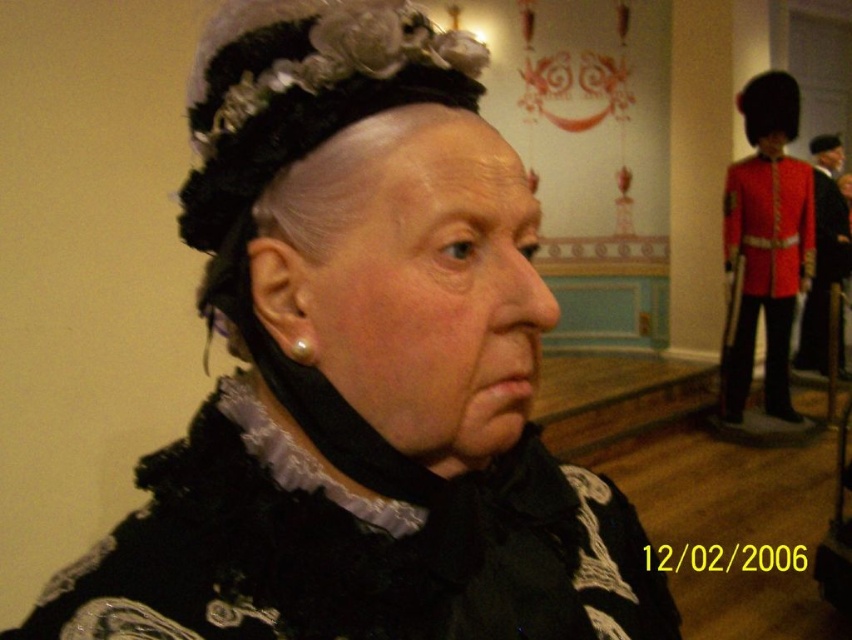
Is black velvet dress at center smaller than red velvet jacket at right?

Indeed, black velvet dress at center has a smaller size compared to red velvet jacket at right.

In the scene shown: Is black velvet dress at center thinner than red velvet jacket at right?

Yes, black velvet dress at center is thinner than red velvet jacket at right.

You are a GUI agent. You are given a task and a screenshot of the screen. Output one action in this format:
    pyautogui.click(x=<x>, y=<y>)
    Task: Click on the black velvet dress at center
    The width and height of the screenshot is (852, 640).
    Given the screenshot: What is the action you would take?
    pyautogui.click(x=354, y=548)

Is point (268, 566) positioned before point (838, 220)?

Yes, it is in front of point (838, 220).

Is black velvet dress at center positioned before red woolen uniform at right?

Yes.

Find the location of `black velvet dress at center`. black velvet dress at center is located at coordinates (354, 548).

Locate an element on the screen. This screenshot has width=852, height=640. black velvet dress at center is located at coordinates (354, 548).

Image resolution: width=852 pixels, height=640 pixels. Describe the element at coordinates (764, 268) in the screenshot. I see `red velvet jacket at right` at that location.

Which is behind, point (760, 168) or point (818, 288)?

Positioned behind is point (818, 288).

Who is more forward, (x=792, y=179) or (x=833, y=212)?

Point (x=792, y=179) is more forward.

Where is `red velvet jacket at right`? red velvet jacket at right is located at coordinates (764, 268).